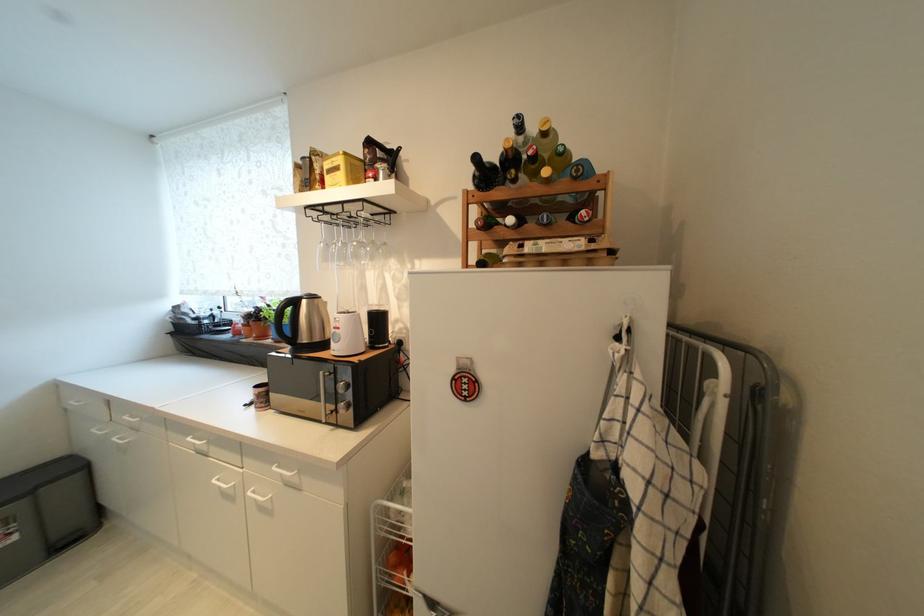
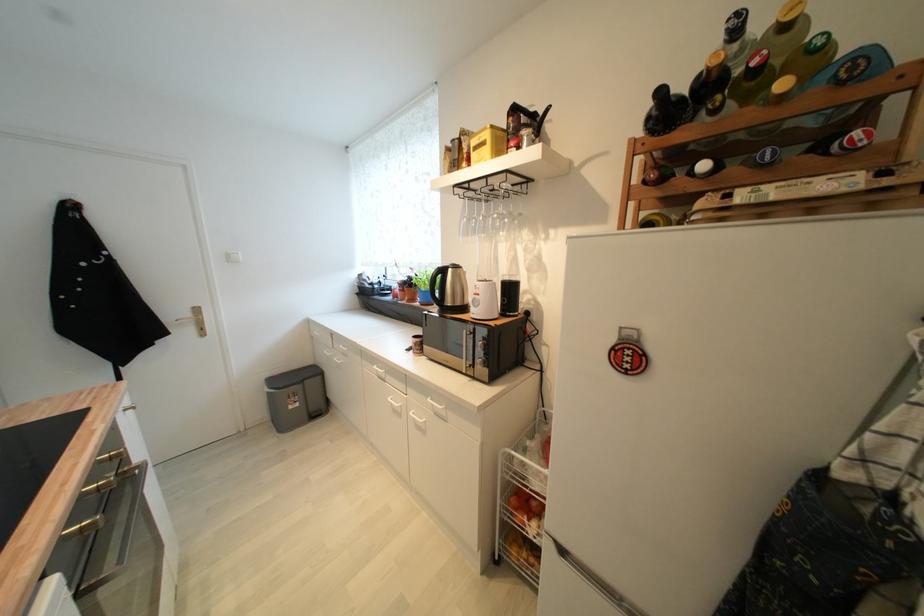
In the second image, find the point that corresponds to point (548, 217) in the first image.

(769, 155)